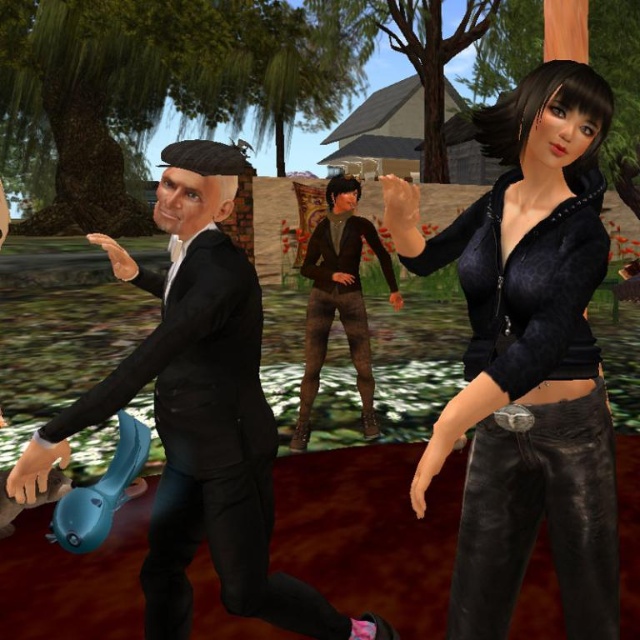
You are a character in this scene and need to determine the relative positions of two points. Which point is closer to you, point (484,616) or point (24,451)?

Point (24,451) is closer to you because it is less further to the camera than point (484,616).

You are a character in the scene and want to move from the black matte suit at left to the brown leather pants at center. Which direction should you move?

The black matte suit at left is to the left of brown leather pants at center, so you should move to the right to reach the brown leather pants at center from the black matte suit at left.